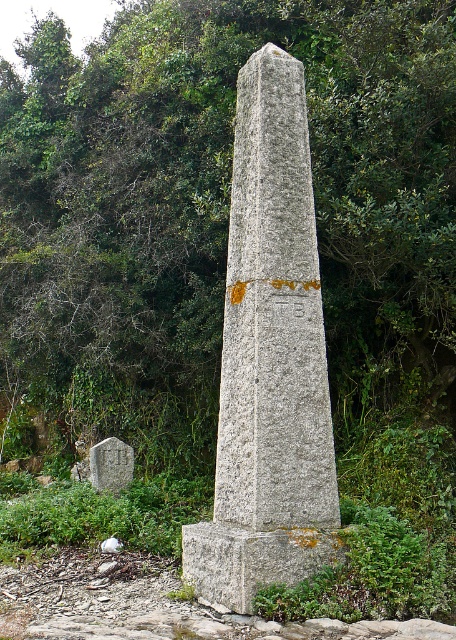
You are standing at the gray concrete at lower left and want to reach the gray stone obelisk at center. Which direction should you move to get there?

The gray stone obelisk at center is located above the gray concrete at lower left, so you should move upward to reach it.

You are standing at the gray concrete at lower left and want to reach the gray stone obelisk at center. In which direction should you walk to get there?

The gray stone obelisk at center is positioned on the right side of gray concrete at lower left, so you should walk to your right to reach it.